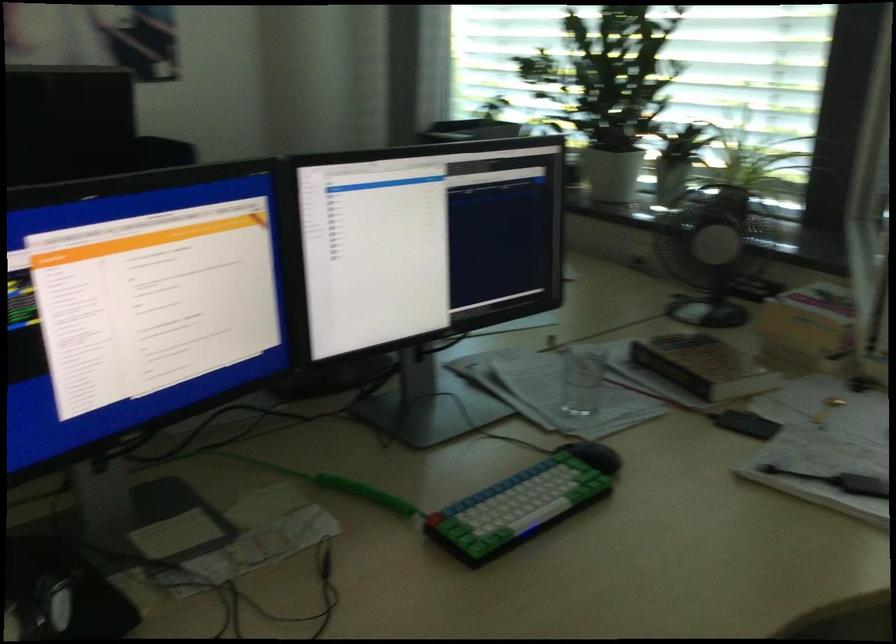
I want to click on small cardboard box, so click(x=810, y=326).